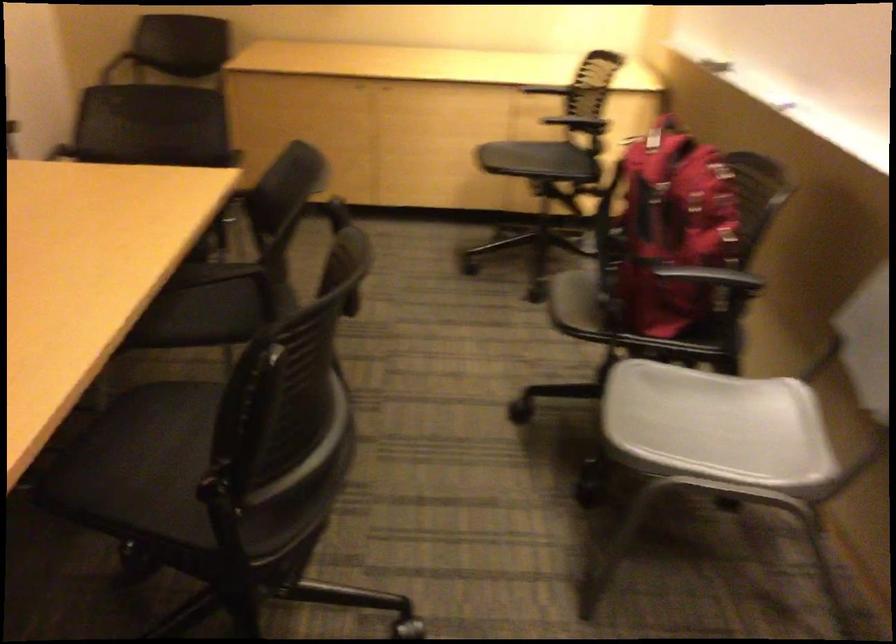
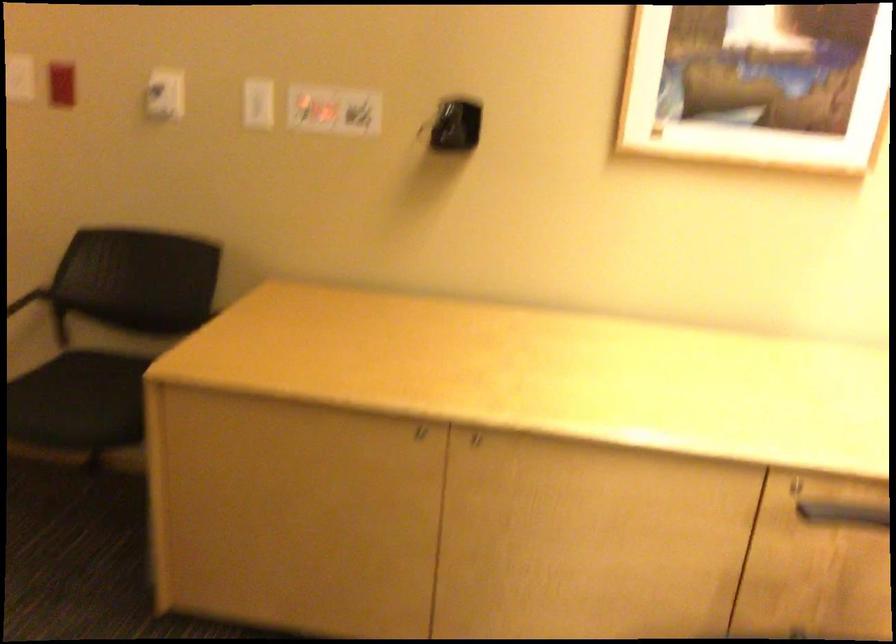
Where in the second image is the point corresponding to the point at 376,79 from the first image?

(472, 437)